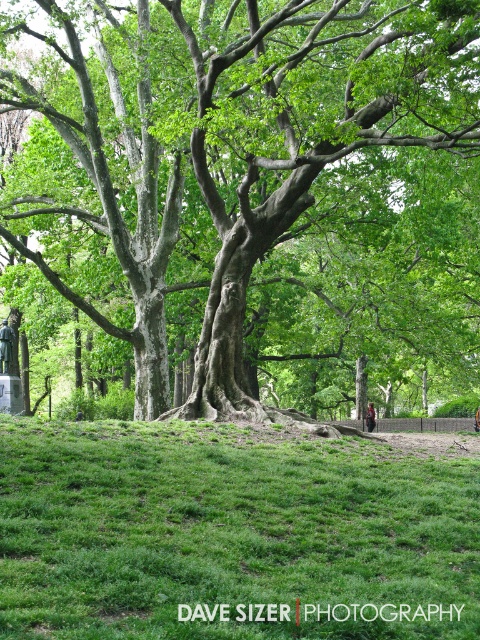
You are a hiker who wants to place your brown leather backpack at lower right on the green grassy hill at lower center. Can you determine if the backpack will fit on the hill?

The green grassy hill at lower center might be wider than brown leather backpack at lower right, so there is a possibility that the backpack will fit, but it is uncertain due to the comparative width.

You are standing at the camera position and want to take a photo of the green rough bark tree at center. If your camera can focus on objects up to 50 feet away, will it be able to capture the tree clearly?

The green rough bark tree at center and camera are 46.99 feet apart from each other. Since 46.99 feet is less than 50 feet, the camera can focus on the tree and capture it clearly.